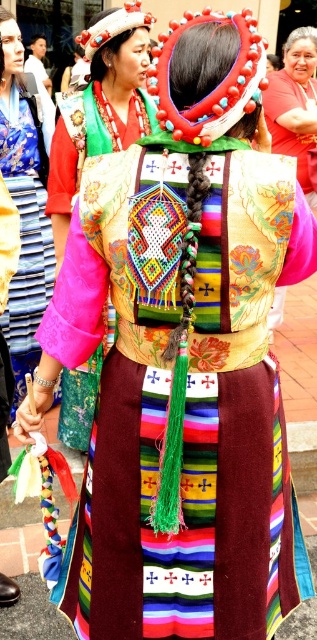
Question: Which of the following is the closest to the observer?

Choices:
 (A) velvet dress at center
 (B) velvet pink blouse at center

Answer: (A)

Question: Can you confirm if velvet pink blouse at center is thinner than matte red blouse at center?

Choices:
 (A) yes
 (B) no

Answer: (A)

Question: Does velvet pink blouse at center come behind matte red blouse at center?

Choices:
 (A) yes
 (B) no

Answer: (B)

Question: Which point is farther to the camera?

Choices:
 (A) velvet dress at center
 (B) velvet pink blouse at center

Answer: (B)

Question: Does velvet dress at center appear on the right side of matte red blouse at center?

Choices:
 (A) no
 (B) yes

Answer: (A)

Question: Based on their relative distances, which object is farther from the velvet dress at center?

Choices:
 (A) matte red blouse at center
 (B) velvet pink blouse at center

Answer: (A)